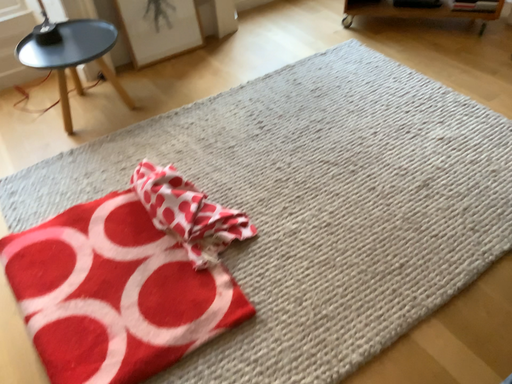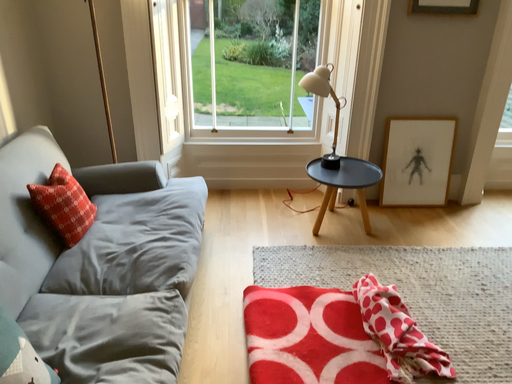
Question: How did the camera likely rotate when shooting the video?

Choices:
 (A) rotated upward
 (B) rotated downward

Answer: (A)